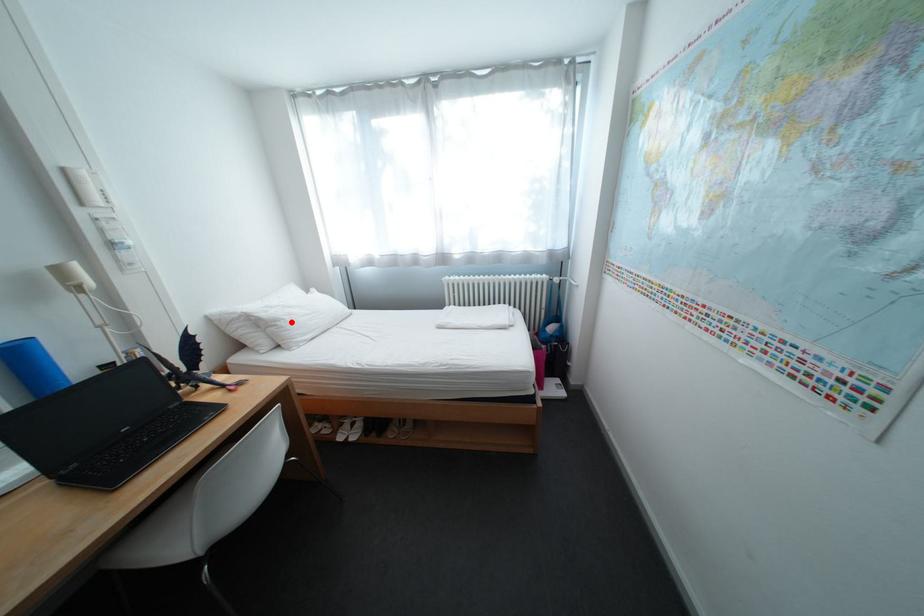
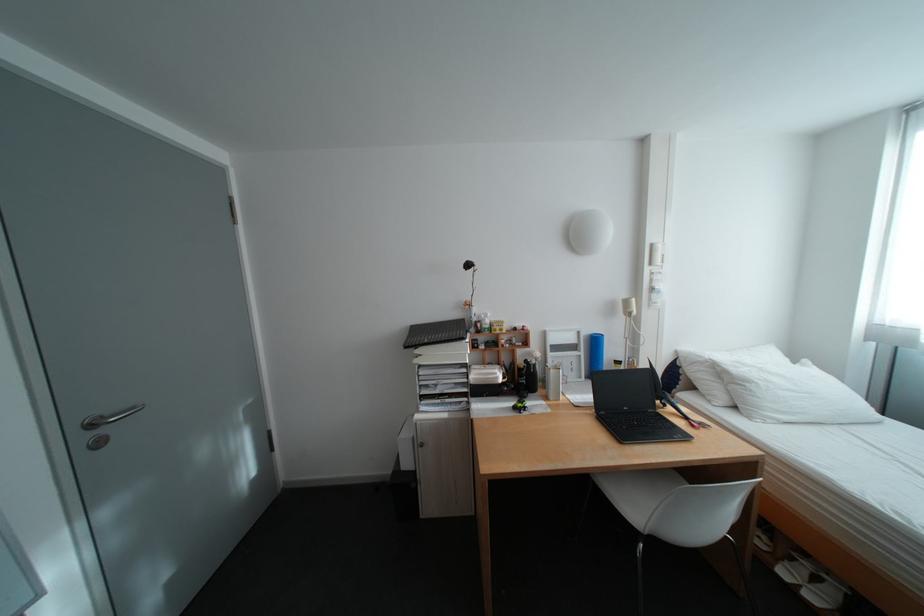
Locate, in the second image, the point that corresponds to the highlighted location in the first image.

(761, 384)